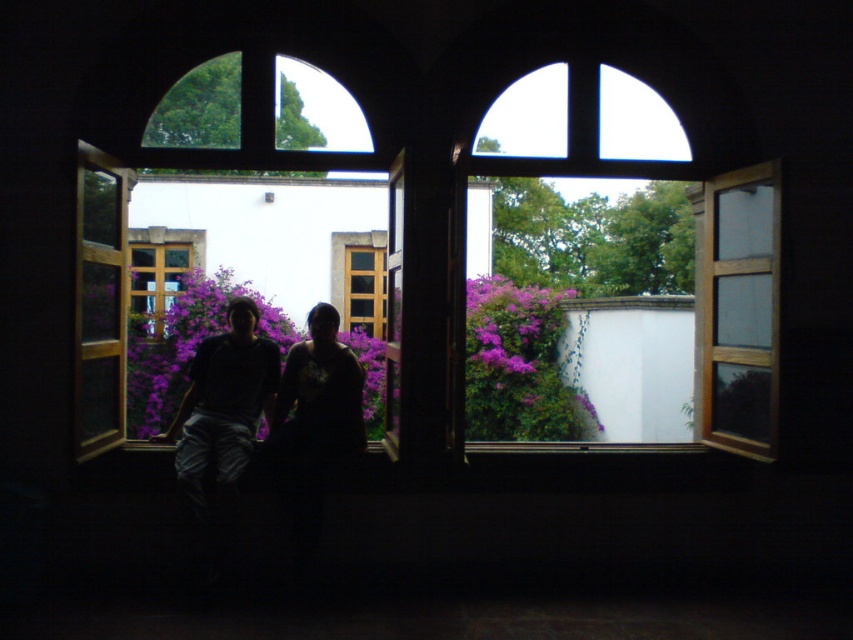
Based on the photo, you are standing in the interior space looking through the two open windows. You notice a point marked at coordinates (x=260, y=400). What object is located at that point?

The point at coordinates (x=260, y=400) is where the dark clothing at center is located.

You are standing inside the building and looking through the two open windows. There are purple matte flowers at center. Based on their position, can you determine if they are closer to the left or right side of the windows?

The purple matte flowers at center are located at point coordinates that place them near the center of the windows, so they are neither closer to the left nor the right side but centrally positioned.